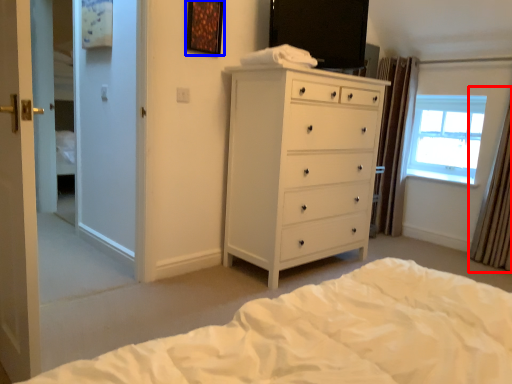
Question: Which object is further to the camera taking this photo, curtain (highlighted by a red box) or picture frame (highlighted by a blue box)?

Choices:
 (A) curtain
 (B) picture frame

Answer: (A)